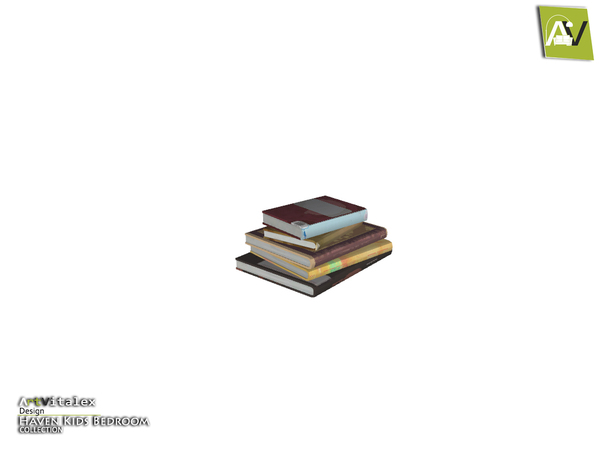
Locate an element on the screen. light is located at coordinates (570, 25).